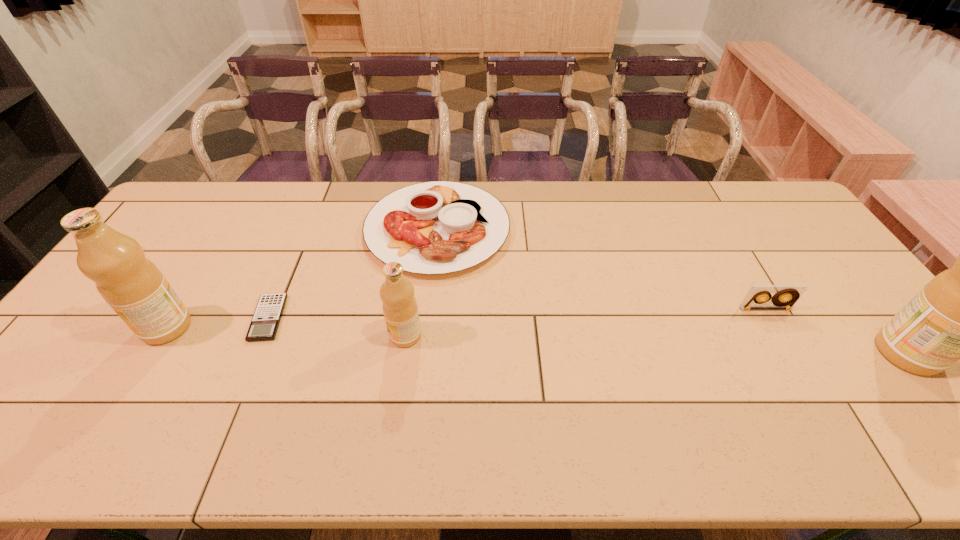
If equal spacing is desired by inserting an extra olive_oil among them, please point out a free spot for this new olive_oil. Please provide its 2D coordinates. Your answer should be formatted as a tuple, i.e. [(x, y)], where the tuple contains the x and y coordinates of a point satisfying the conditions above.

[(652, 344)]